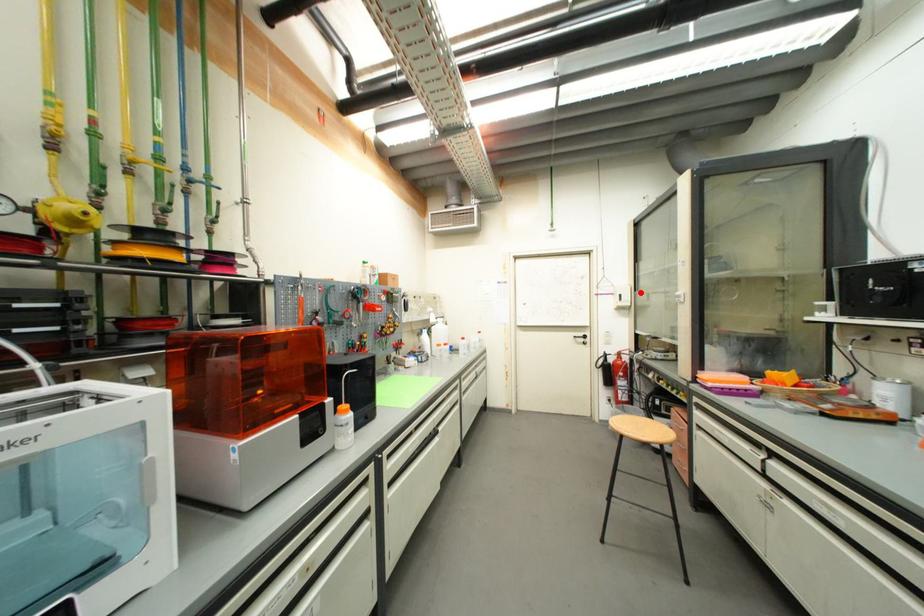
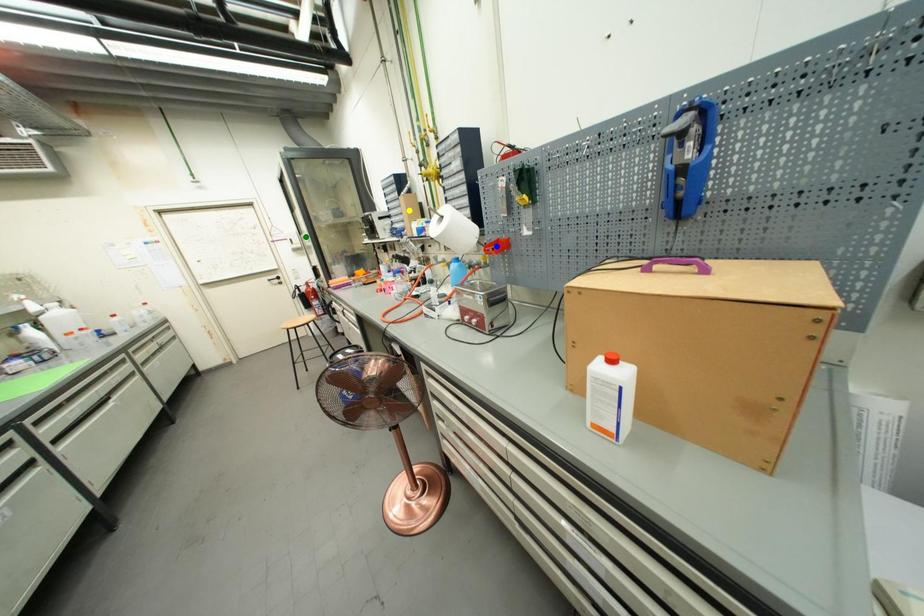
Question: I am providing you with two images of the same scene from different viewpoints. A red point is marked on the first image. You are given multiple points on the second image. Which mark in image 2 goes with the point in image 1?

Choices:
 (A) blue point
 (B) yellow point
 (C) green point

Answer: (C)